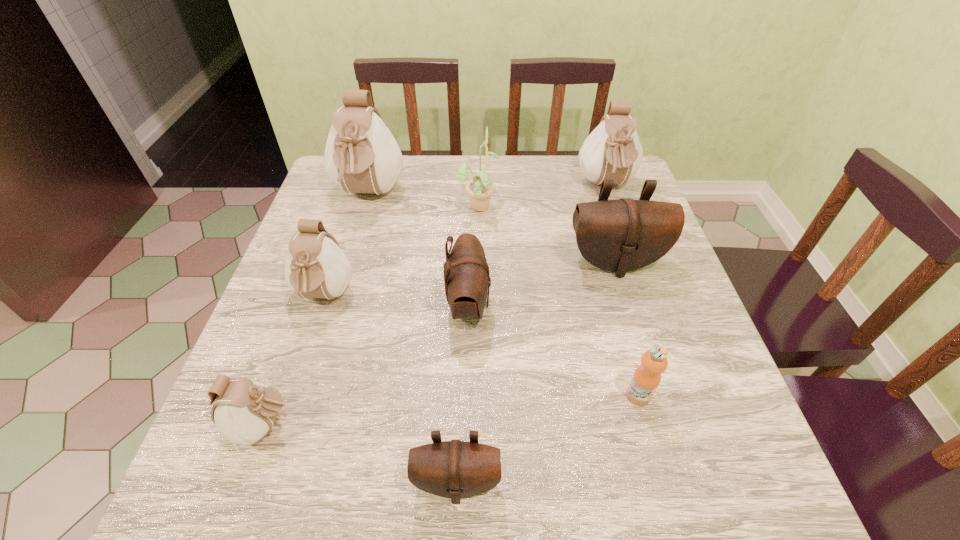
In the image, there is a desktop. Where is `vacant region at the far right corner`? This screenshot has width=960, height=540. vacant region at the far right corner is located at coordinates (578, 165).

The image size is (960, 540). Identify the location of vacant space at the near right corner of the desktop. (756, 472).

This screenshot has height=540, width=960. Identify the location of vacant area that lies between the orange juice and the rightmost brown pouch. (627, 329).

Where is `free space between the biggest white pouch and the third biggest white pouch`? Image resolution: width=960 pixels, height=540 pixels. free space between the biggest white pouch and the third biggest white pouch is located at coordinates (347, 246).

Identify the location of vacant area that lies between the third smallest white pouch and the sixth farthest pouch. (436, 306).

Where is `unoccupied area between the sixth farthest pouch and the third biggest white pouch`? unoccupied area between the sixth farthest pouch and the third biggest white pouch is located at coordinates (295, 361).

You are a GUI agent. You are given a task and a screenshot of the screen. Output one action in this format:
    pyautogui.click(x=<x>, y=<y>)
    Task: Click on the unoccupied area between the nearest object and the second smallest brown pouch
    This screenshot has height=540, width=960.
    Given the screenshot: What is the action you would take?
    pyautogui.click(x=463, y=394)

Locate an element on the screen. This screenshot has width=960, height=540. free space that is in between the yellow sunflower and the second smallest white pouch is located at coordinates (401, 251).

At what (x,y) coordinates should I click in order to perform the action: click on vacant area that lies between the sunflower and the tallest pouch. Please return your answer as a coordinate pair (x, y). Looking at the image, I should click on (423, 200).

The image size is (960, 540). I want to click on the seventh closest object to the third smallest white pouch, so click(455, 469).